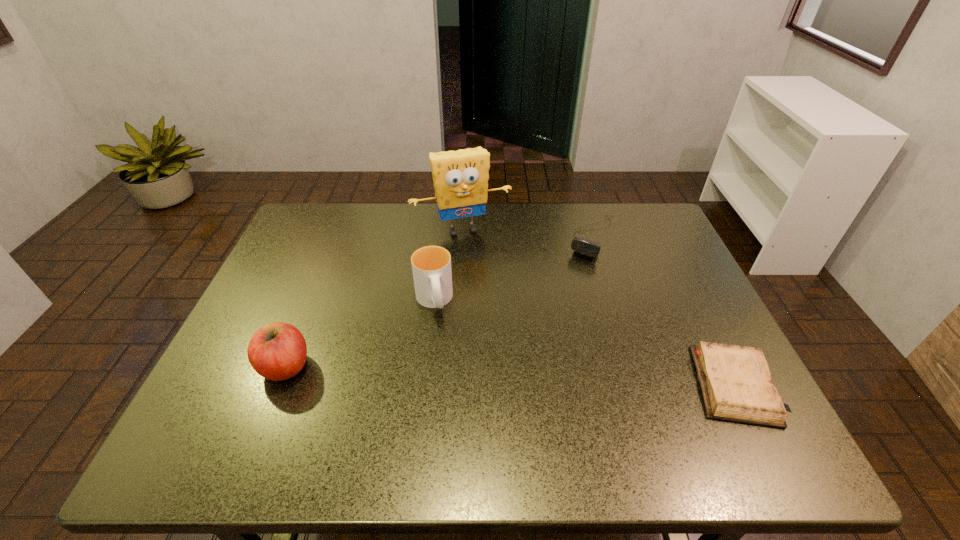
The height and width of the screenshot is (540, 960). In order to click on vacant area that lies between the sponge and the fourth tallest object in this screenshot , I will do `click(527, 233)`.

Locate an element on the screen. empty space that is in between the leftmost object and the sponge is located at coordinates tap(374, 298).

Locate an element on the screen. empty space that is in between the shortest object and the third nearest object is located at coordinates (584, 343).

Find the location of `free space between the leftmost object and the tallest object`. free space between the leftmost object and the tallest object is located at coordinates coord(374,298).

Identify the location of object that is the second closest to the webcam. This screenshot has width=960, height=540. pos(735,381).

At what (x,y) coordinates should I click in order to perform the action: click on object that is the second closest to the webcam. Please return your answer as a coordinate pair (x, y). This screenshot has height=540, width=960. Looking at the image, I should click on (735, 381).